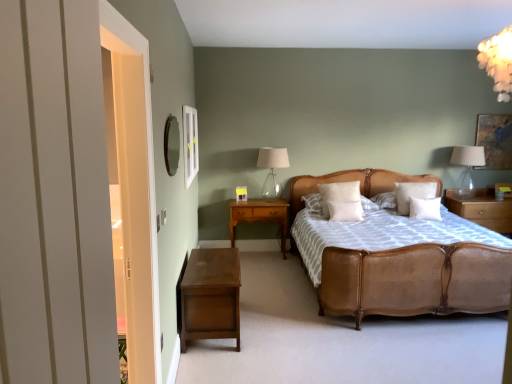
Question: Would you say woven rattan bed at center is a long distance from white soft pillow at center, which ranks as the second pillow in left-to-right order?

Choices:
 (A) yes
 (B) no

Answer: (A)

Question: Considering the relative sizes of woven rattan bed at center and white soft pillow at center, which ranks as the second pillow in left-to-right order, in the image provided, is woven rattan bed at center bigger than white soft pillow at center, which ranks as the second pillow in left-to-right order,?

Choices:
 (A) yes
 (B) no

Answer: (A)

Question: Does woven rattan bed at center have a lesser width compared to white soft pillow at center, which ranks as the second pillow in left-to-right order?

Choices:
 (A) no
 (B) yes

Answer: (A)

Question: From a real-world perspective, is woven rattan bed at center on top of white soft pillow at center, which ranks as the second pillow in left-to-right order?

Choices:
 (A) no
 (B) yes

Answer: (A)

Question: Does woven rattan bed at center appear on the right side of white soft pillow at center, marked as the 3th pillow in a right-to-left arrangement?

Choices:
 (A) no
 (B) yes

Answer: (B)

Question: From their relative heights in the image, would you say white glossy frame at upper left is taller or shorter than white soft pillow at upper right, placed as the 2th pillow when sorted from right to left?

Choices:
 (A) short
 (B) tall

Answer: (B)

Question: In the image, is white glossy frame at upper left positioned in front of or behind white soft pillow at upper right, the third pillow when ordered from left to right?

Choices:
 (A) behind
 (B) front

Answer: (B)

Question: From the image's perspective, is white glossy frame at upper left positioned above or below white soft pillow at upper right, the third pillow when ordered from left to right?

Choices:
 (A) above
 (B) below

Answer: (A)

Question: Does point (197, 160) appear closer or farther from the camera than point (408, 183)?

Choices:
 (A) farther
 (B) closer

Answer: (B)

Question: Considering the positions of white soft pillow at center, marked as the 3th pillow in a right-to-left arrangement, and white soft pillow at upper right, placed as the 2th pillow when sorted from right to left, in the image, is white soft pillow at center, marked as the 3th pillow in a right-to-left arrangement, taller or shorter than white soft pillow at upper right, placed as the 2th pillow when sorted from right to left,?

Choices:
 (A) short
 (B) tall

Answer: (A)

Question: From the image's perspective, is white soft pillow at center, marked as the 3th pillow in a right-to-left arrangement, located above or below white soft pillow at upper right, the third pillow when ordered from left to right?

Choices:
 (A) below
 (B) above

Answer: (A)

Question: Looking at the image, does white soft pillow at center, marked as the 3th pillow in a right-to-left arrangement, seem bigger or smaller compared to white soft pillow at upper right, the third pillow when ordered from left to right?

Choices:
 (A) big
 (B) small

Answer: (B)

Question: Is white soft pillow at center, marked as the 3th pillow in a right-to-left arrangement, inside or outside of white soft pillow at upper right, placed as the 2th pillow when sorted from right to left?

Choices:
 (A) inside
 (B) outside

Answer: (B)

Question: From the image's perspective, is white soft pillow at center, positioned as the first pillow in left-to-right order, above or below wooden mirror at upper left?

Choices:
 (A) below
 (B) above

Answer: (A)

Question: Would you say white soft pillow at center, positioned as the first pillow in left-to-right order, is inside or outside wooden mirror at upper left?

Choices:
 (A) inside
 (B) outside

Answer: (B)